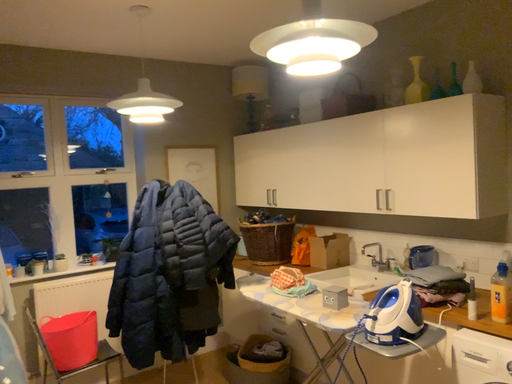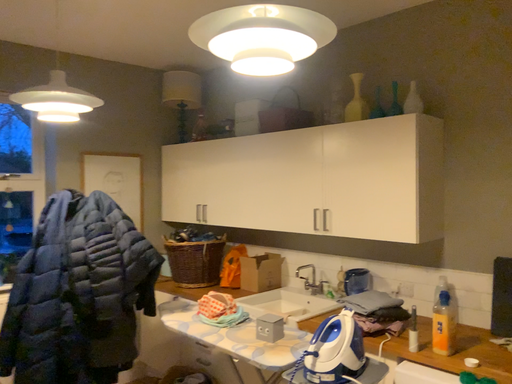
Question: How did the camera likely rotate when shooting the video?

Choices:
 (A) rotated left
 (B) rotated right

Answer: (B)